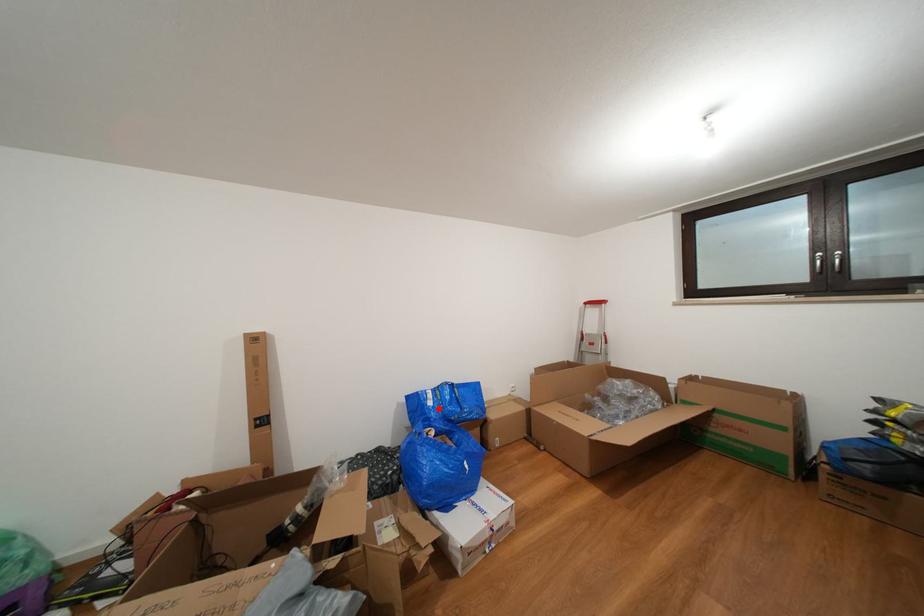
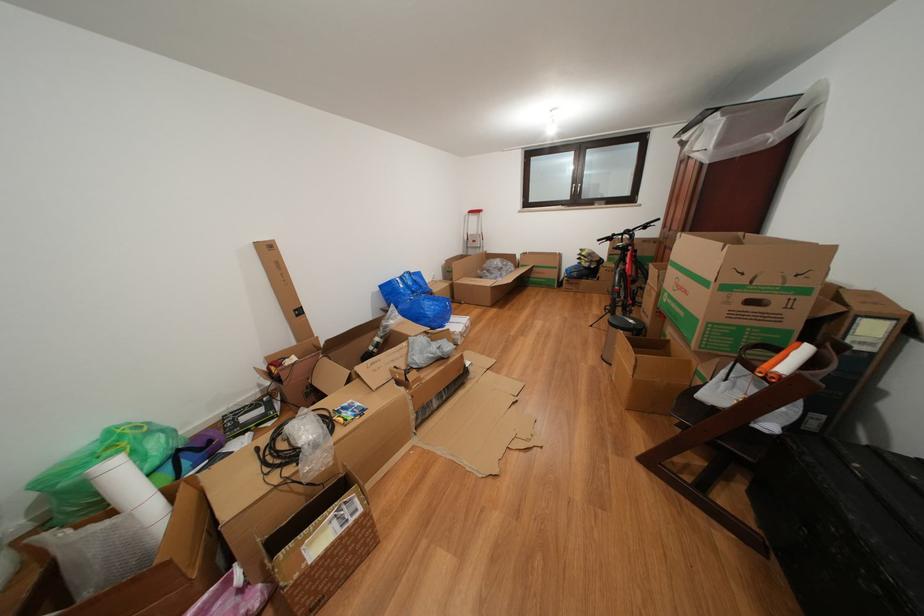
Question: I am providing you with two images of the same scene from different viewpoints. In image1, a red point is highlighted. Considering the same 3D point in image2, which of the following is correct?

Choices:
 (A) It is closer
 (B) It is farther

Answer: (A)